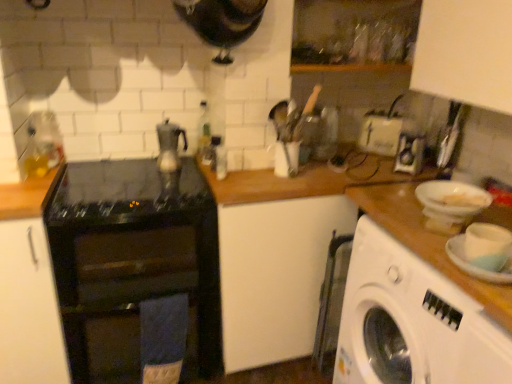
Question: From the image's perspective, is transparent glass bottle at upper center below satin silver teapot at center?

Choices:
 (A) yes
 (B) no

Answer: (B)

Question: Is transparent glass bottle at upper center far from satin silver teapot at center?

Choices:
 (A) no
 (B) yes

Answer: (A)

Question: Is transparent glass bottle at upper center smaller than satin silver teapot at center?

Choices:
 (A) no
 (B) yes

Answer: (B)

Question: From the image's perspective, is transparent glass bottle at upper center located above satin silver teapot at center?

Choices:
 (A) no
 (B) yes

Answer: (B)

Question: From a real-world perspective, is transparent glass bottle at upper center on top of satin silver teapot at center?

Choices:
 (A) yes
 (B) no

Answer: (A)

Question: Looking at their shapes, would you say white plastic basin at right is wider or thinner than white matte plate at right?

Choices:
 (A) wide
 (B) thin

Answer: (B)

Question: Is point (446, 183) closer or farther from the camera than point (510, 256)?

Choices:
 (A) closer
 (B) farther

Answer: (B)

Question: Considering the positions of white plastic basin at right and white matte plate at right in the image, is white plastic basin at right taller or shorter than white matte plate at right?

Choices:
 (A) tall
 (B) short

Answer: (B)

Question: Based on their sizes in the image, would you say white plastic basin at right is bigger or smaller than white matte plate at right?

Choices:
 (A) small
 (B) big

Answer: (A)

Question: Is metallic silver kettle at center, the 1th appliance viewed from the left, spatially inside white plastic basin at right, or outside of it?

Choices:
 (A) outside
 (B) inside

Answer: (A)

Question: Based on their sizes in the image, would you say metallic silver kettle at center, the 1th appliance viewed from the left, is bigger or smaller than white plastic basin at right?

Choices:
 (A) big
 (B) small

Answer: (B)

Question: In the image, is metallic silver kettle at center, the 1th appliance viewed from the left, on the left side or the right side of white plastic basin at right?

Choices:
 (A) left
 (B) right

Answer: (A)

Question: Is point (202, 158) closer or farther from the camera than point (415, 195)?

Choices:
 (A) farther
 (B) closer

Answer: (A)

Question: From a real-world perspective, is metallic silver kettle at center, the 1th appliance viewed from the left, above or below white plastic toaster at center, acting as the first appliance starting from the right?

Choices:
 (A) above
 (B) below

Answer: (B)

Question: From the image's perspective, relative to white plastic toaster at center, acting as the first appliance starting from the right, is metallic silver kettle at center, placed as the second appliance when sorted from back to front, above or below?

Choices:
 (A) below
 (B) above

Answer: (A)